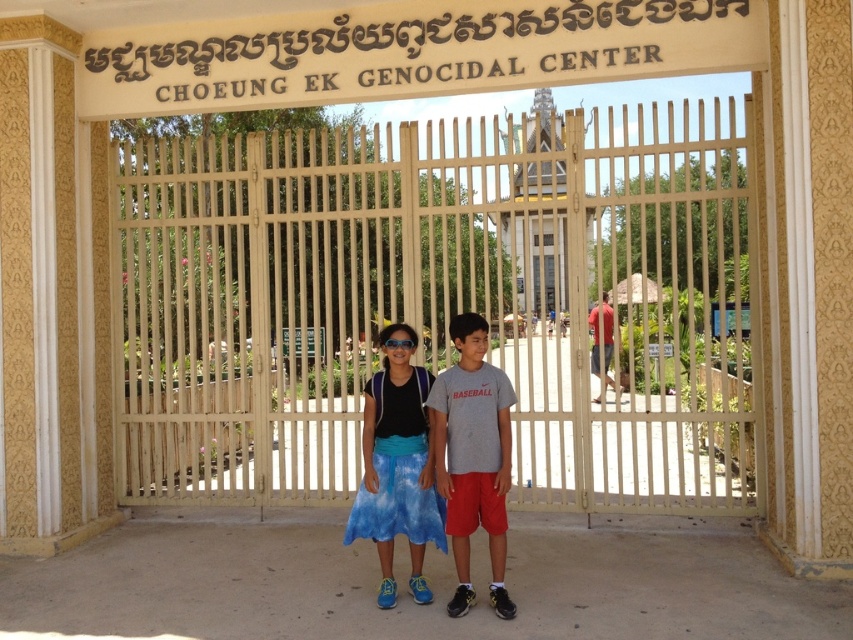
Which is behind, point (325, 136) or point (496, 579)?

Point (325, 136)

Is point (358, 172) more distant than point (463, 387)?

Yes.

Which is behind, point (198, 157) or point (457, 513)?

Point (198, 157)

Locate an element on the screen. The image size is (853, 640). beige metal gate at center is located at coordinates (440, 301).

Can you confirm if blue tie-dye skirt at center is taller than transparent plastic goggles at center?

Indeed, blue tie-dye skirt at center has a greater height compared to transparent plastic goggles at center.

Looking at this image, who is more distant from viewer, (x=370, y=529) or (x=404, y=346)?

The point (x=370, y=529) is behind.

Where is `blue tie-dye skirt at center`? The image size is (853, 640). blue tie-dye skirt at center is located at coordinates (397, 468).

Is beige metal gate at center taller than transparent plastic goggles at center?

Correct, beige metal gate at center is much taller as transparent plastic goggles at center.

Is beige metal gate at center to the left of transparent plastic goggles at center from the viewer's perspective?

Correct, you'll find beige metal gate at center to the left of transparent plastic goggles at center.

Does point (457, 154) come in front of point (413, 342)?

No, it is not.

Image resolution: width=853 pixels, height=640 pixels. Identify the location of beige metal gate at center. (440, 301).